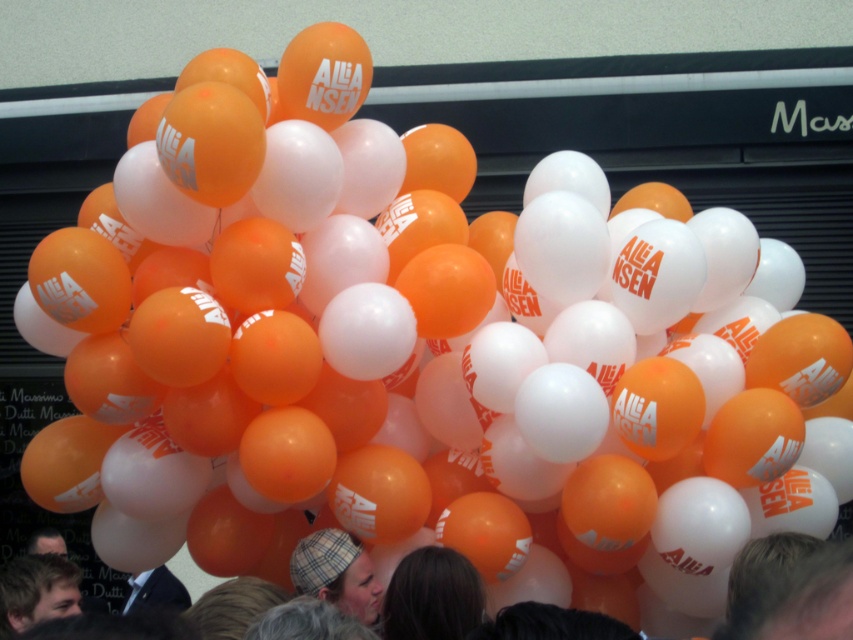
You are a photographer taking a picture of the scene. You notice the dark brown hair at lower center is blocking part of the balloons. To avoid this, should you move the camera to the left or right?

Since the dark brown hair at lower center is at point 0.933 on the x axis, moving the camera to the left would move it away from the obstruction. Therefore, move the camera to the left.

You are at a political rally and want to take a photo of the orange matte balloons at center and the plaid fabric hat at center. To ensure both are in focus, which one should you focus on first?

You should focus on the orange matte balloons at center first because they are closer to the viewer than the plaid fabric hat at center, so adjusting focus from near to far will help both be in focus.